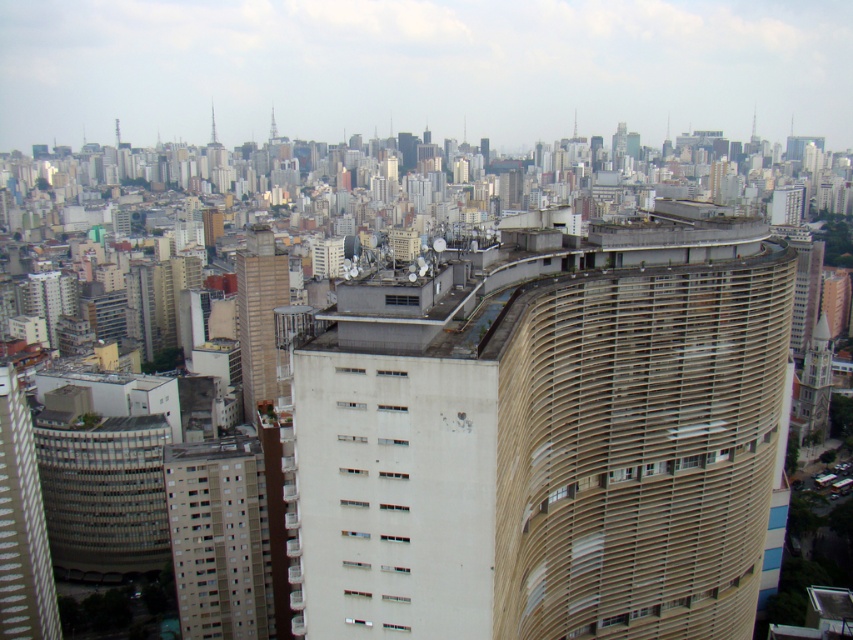
Does beige concrete building at lower left appear under beige concrete building at center?

Yes.

Between beige concrete building at lower left and beige concrete building at center, which one is positioned higher?

Positioned higher is beige concrete building at center.

Does point (215, 490) lie behind point (265, 371)?

No, it is in front of (265, 371).

Find the location of `beige concrete building at lower left`. beige concrete building at lower left is located at coordinates (219, 538).

Between point (712, 636) and point (238, 268), which one is positioned behind?

The point (238, 268) is behind.

Between beige textured building at center and beige concrete building at center, which one is positioned higher?

beige concrete building at center is above.

Is point (791, 282) closer to viewer compared to point (247, 358)?

Yes.

Where is `beige textured building at center`? This screenshot has height=640, width=853. beige textured building at center is located at coordinates (546, 440).

Is beige textured building at center bigger than white textured building at left?

Correct, beige textured building at center is larger in size than white textured building at left.

Find the location of a particular element. beige textured building at center is located at coordinates (546, 440).

The height and width of the screenshot is (640, 853). Identify the location of beige textured building at center. (546, 440).